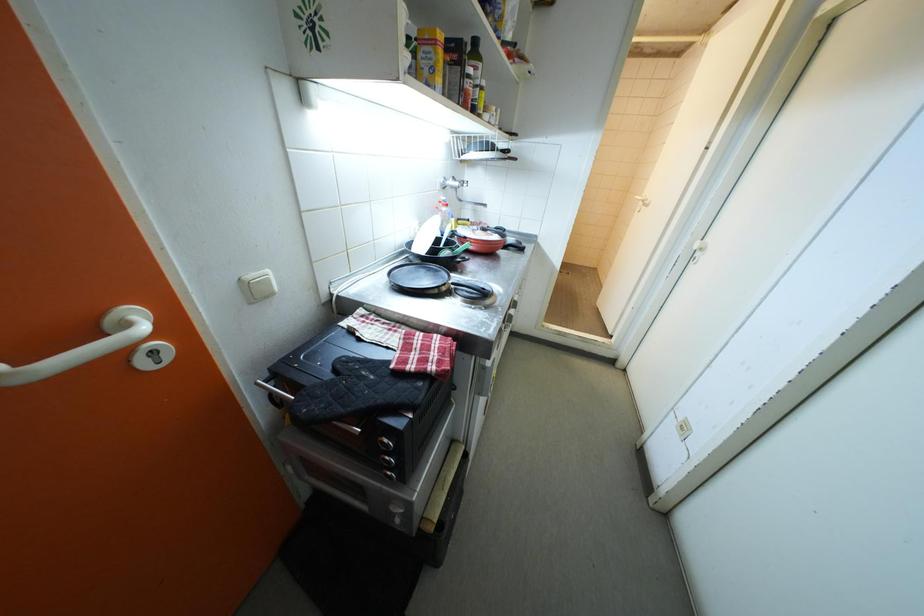
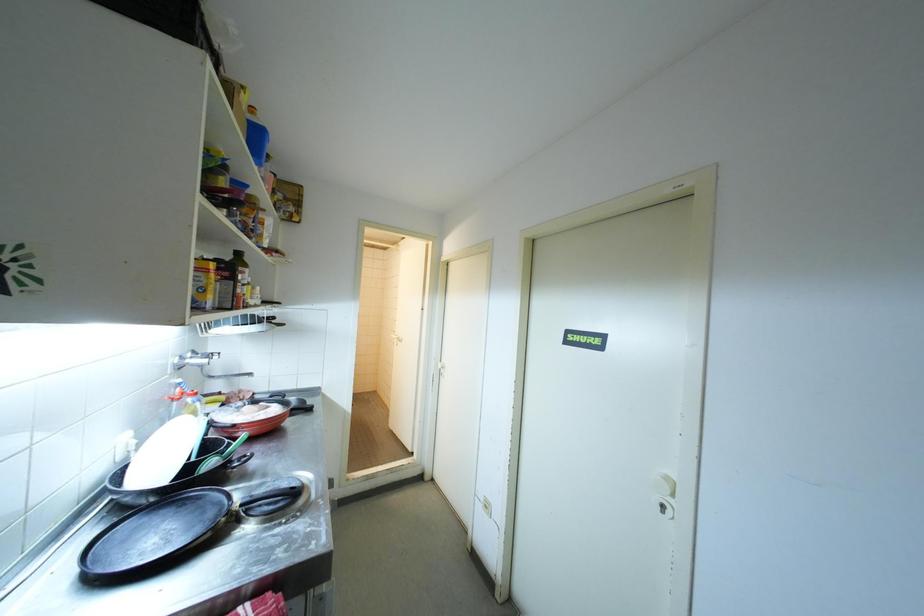
First-person continuous shooting, in which direction is the camera rotating?

The camera's rotation is toward right-up.